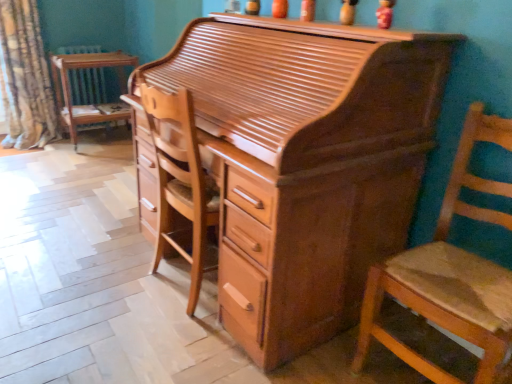
Question: Considering the relative positions of patterned fabric curtain at left and wooden chair at left in the image provided, is patterned fabric curtain at left to the left or to the right of wooden chair at left?

Choices:
 (A) left
 (B) right

Answer: (A)

Question: Considering the positions of patterned fabric curtain at left and wooden chair at left in the image, is patterned fabric curtain at left bigger or smaller than wooden chair at left?

Choices:
 (A) big
 (B) small

Answer: (A)

Question: Which object is the closest to the wooden chair at left?

Choices:
 (A) wooden chair at right
 (B) shiny brown wood desk at center
 (C) patterned fabric curtain at left
 (D) wooden radiator at left

Answer: (D)

Question: Which object is the farthest from the wooden chair at left?

Choices:
 (A) patterned fabric curtain at left
 (B) wooden radiator at left
 (C) shiny brown wood desk at center
 (D) wooden chair at right

Answer: (D)